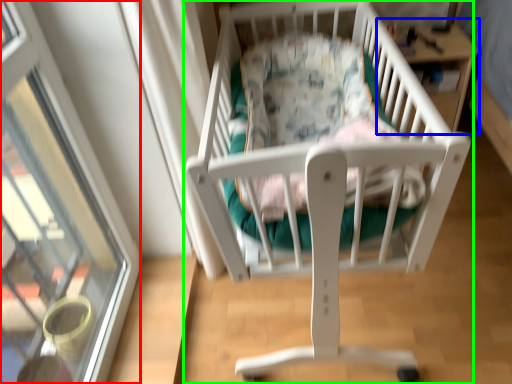
Question: Based on their relative distances, which object is farther from glass door (highlighted by a red box)? Choose from table (highlighted by a blue box) and infant bed (highlighted by a green box).

Choices:
 (A) table
 (B) infant bed

Answer: (A)